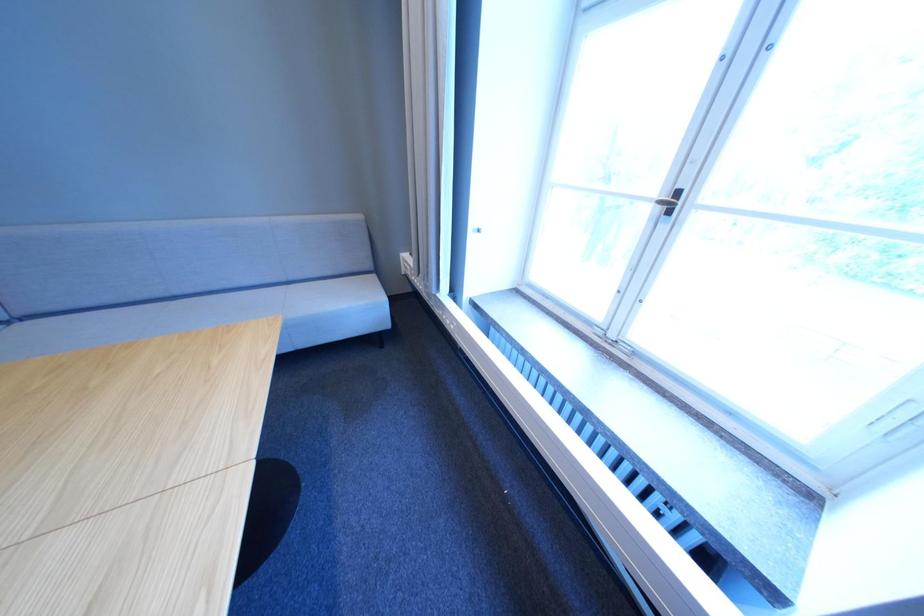
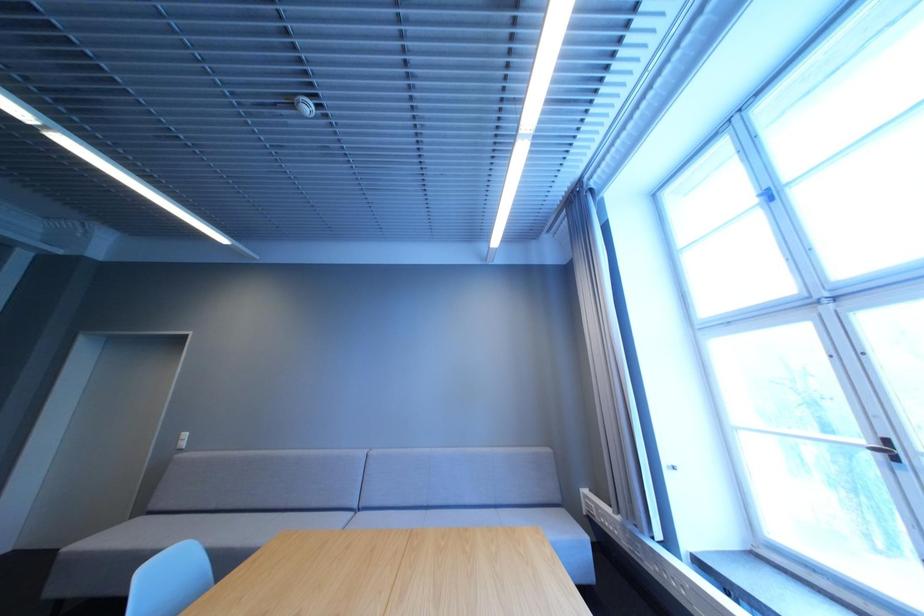
Based on the continuous images, in which direction is the camera rotating?

The camera rotated toward left-up.